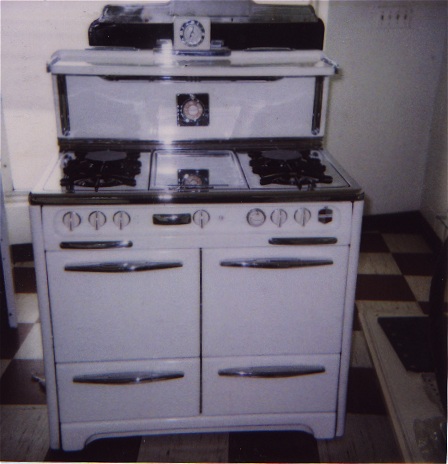
I want to click on wall, so click(406, 64).